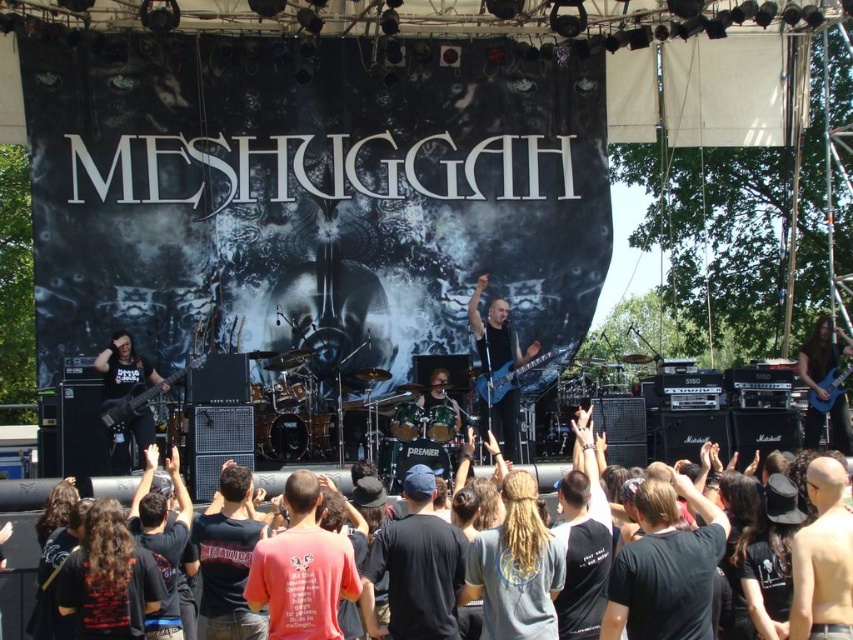
Question: Can you confirm if matte black bass guitar at left is bigger than blue glossy electric guitar at upper right?

Choices:
 (A) yes
 (B) no

Answer: (B)

Question: Which object is the closest to the matte black bass guitar at left?

Choices:
 (A) blue glossy electric guitar at upper right
 (B) shiny black guitar at center

Answer: (B)

Question: Is shiny black guitar at center smaller than matte black bass guitar at left?

Choices:
 (A) no
 (B) yes

Answer: (A)

Question: Estimate the real-world distances between objects in this image. Which object is closer to the shiny black drum set at center?

Choices:
 (A) black t-shirts at center
 (B) shiny black guitar at center

Answer: (B)

Question: Among these objects, which one is nearest to the camera?

Choices:
 (A) black t-shirts at center
 (B) blue glossy electric guitar at upper right

Answer: (A)

Question: Is shiny black guitar at center smaller than blue glossy electric guitar at upper right?

Choices:
 (A) no
 (B) yes

Answer: (B)